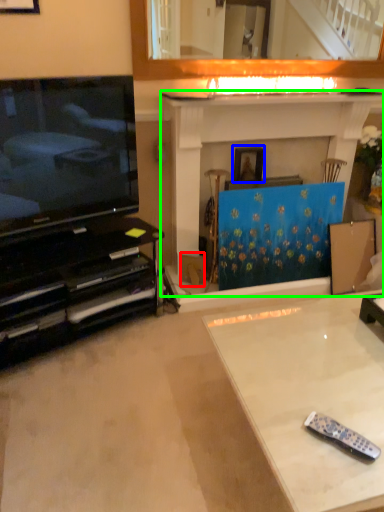
Question: Based on their relative distances, which object is nearer to cardboard box (highlighted by a red box)? Choose from picture frame (highlighted by a blue box) and fireplace (highlighted by a green box).

Choices:
 (A) picture frame
 (B) fireplace

Answer: (A)